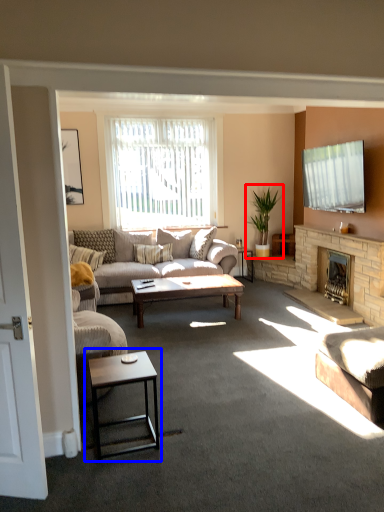
Question: Which point is closer to the camera, houseplant (highlighted by a red box) or coffee table (highlighted by a blue box)?

Choices:
 (A) houseplant
 (B) coffee table

Answer: (B)